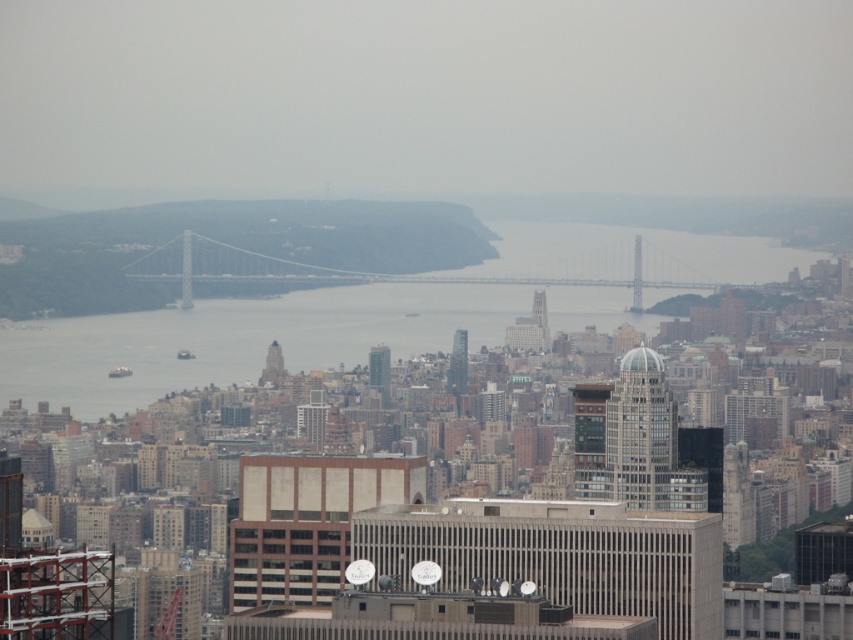
Question: Which of the following is the farthest from the observer?

Choices:
 (A) white metallic suspension bridge at center
 (B) clear glass skyscraper at center
 (C) beige concrete building at center

Answer: (B)

Question: Among these points, which one is farthest from the camera?

Choices:
 (A) (463, 330)
 (B) (306, 547)
 (C) (190, 248)

Answer: (B)

Question: Does clear glass skyscraper at center come in front of glassy silver skyscraper at center?

Choices:
 (A) no
 (B) yes

Answer: (A)

Question: Estimate the real-world distances between objects in this image. Which object is closer to the glassy skyscraper at center?

Choices:
 (A) gray water at center
 (B) beige concrete building at center
 (C) glassy silver skyscraper at center

Answer: (C)

Question: Is white metallic suspension bridge at center bigger than clear glass skyscraper at center?

Choices:
 (A) yes
 (B) no

Answer: (A)

Question: Is beige concrete building at center smaller than white metallic suspension bridge at center?

Choices:
 (A) yes
 (B) no

Answer: (A)